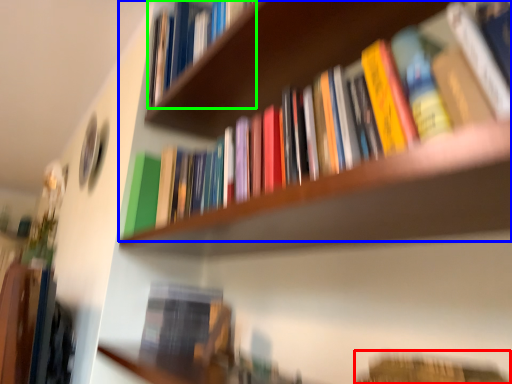
Question: Which object is the closest to the book (highlighted by a red box)? Choose among these: book (highlighted by a blue box) or book (highlighted by a green box).

Choices:
 (A) book
 (B) book

Answer: (A)